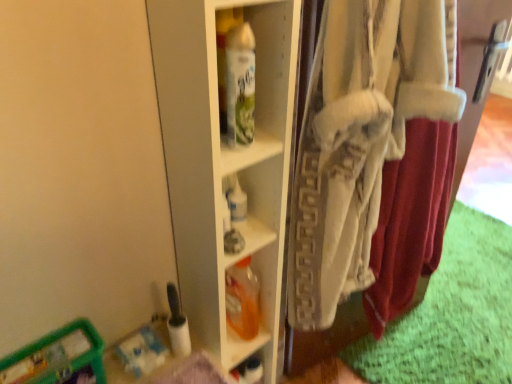
Question: Considering the positions of white cotton underclothes at right and translucent orange plastic bottle at center, the 2th bottle positioned from the top, in the image, is white cotton underclothes at right bigger or smaller than translucent orange plastic bottle at center, the 2th bottle positioned from the top,?

Choices:
 (A) small
 (B) big

Answer: (B)

Question: In terms of width, does white cotton underclothes at right look wider or thinner when compared to translucent orange plastic bottle at center, acting as the first bottle starting from the bottom?

Choices:
 (A) thin
 (B) wide

Answer: (A)

Question: Estimate the real-world distances between objects in this image. Which object is farther from the white glossy spray can at center, the 2th bottle when ordered from bottom to top?

Choices:
 (A) white cotton underclothes at right
 (B) white glossy shelf at center
 (C) translucent orange plastic bottle at center, the 1th bottle when ordered from back to front
 (D) translucent plastic container at lower left

Answer: (D)

Question: Which of these objects is positioned closest to the translucent plastic container at lower left?

Choices:
 (A) translucent orange plastic bottle at center, which ranks as the second bottle in front-to-back order
 (B) white glossy shelf at center
 (C) white glossy spray can at center, placed as the 1th bottle when sorted from top to bottom
 (D) white cotton underclothes at right

Answer: (A)